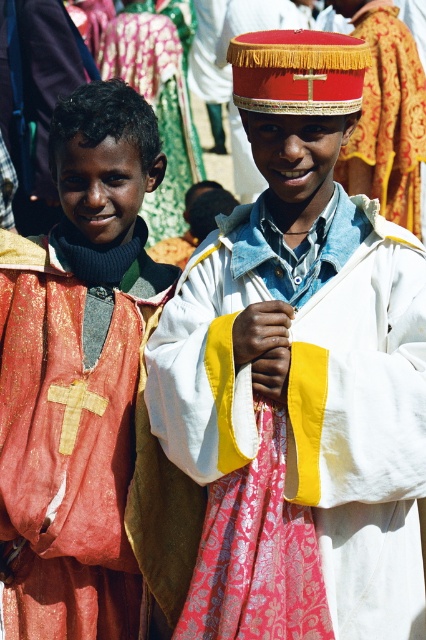
You are a photographer trying to capture both boys in a single shot. You notice two specific points in the image labeled as point 1 and point 2. Point 1 is located at coordinates point (276,230) and point 2 is at point (112,547). Based on their positions, which point is closer to you, the photographer?

Point (276,230) is closer to you than point (112,547) because it is further to the viewer.